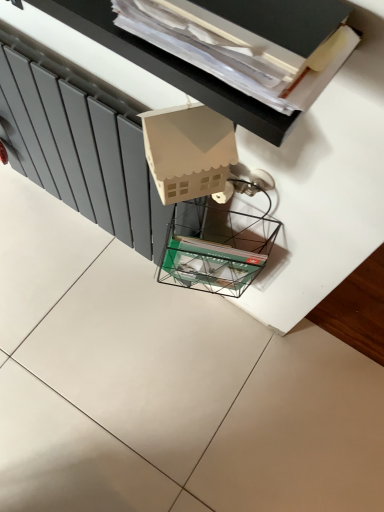
Identify the location of free space to the left of matte gray radiator at left. (41, 233).